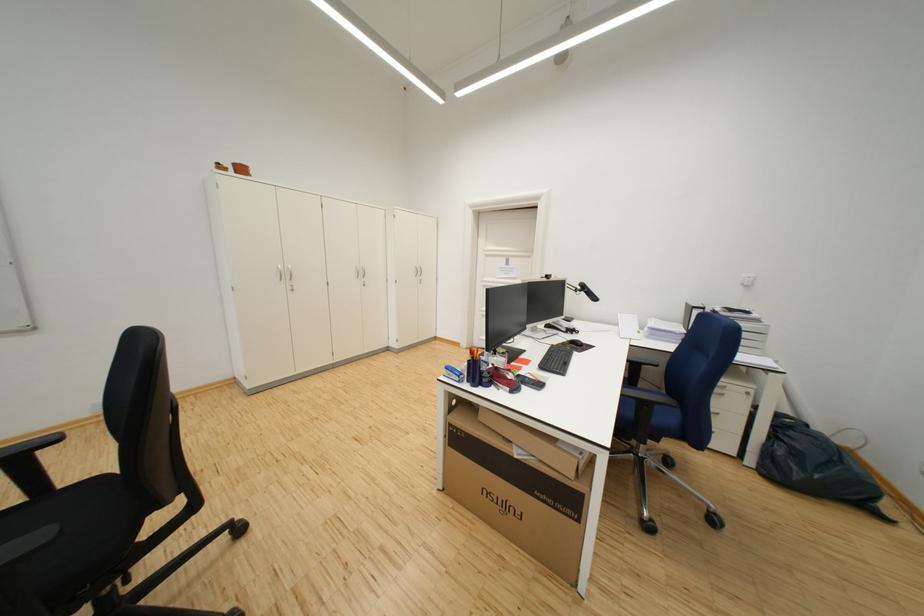
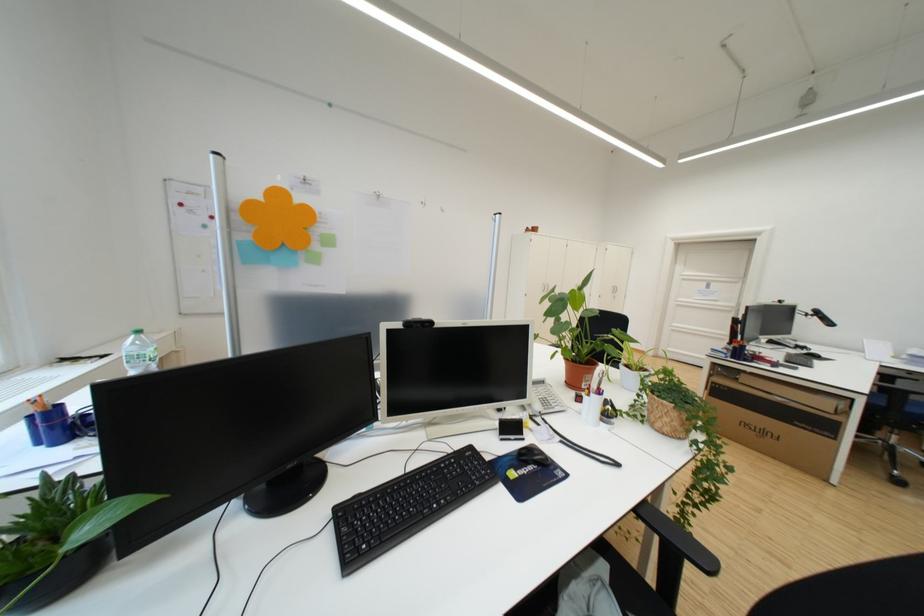
Question: I am providing you with two images of the same scene from different viewpoints. Please identify which objects are invisible in image2.

Choices:
 (A) bottle cap
 (B) terracotta plant pot
 (C) chair sitting surface
 (D) none of these

Answer: (D)